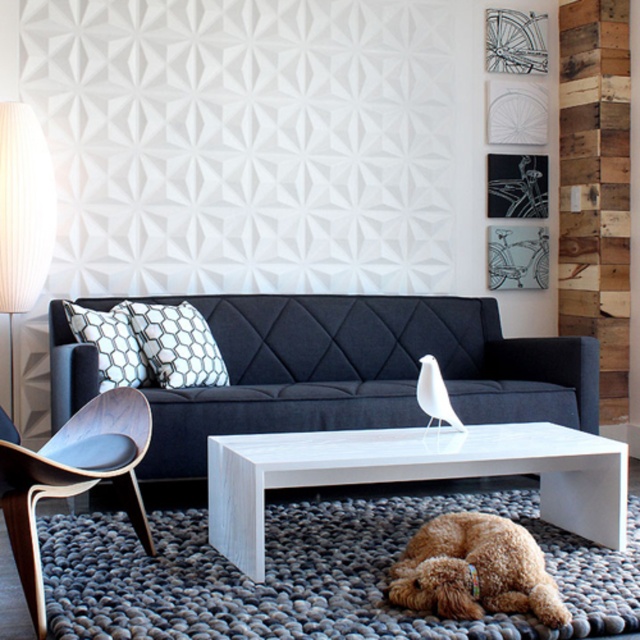
Is dark blue fabric couch at center in front of white pleated fabric lampshade at left?

Yes, dark blue fabric couch at center is in front of white pleated fabric lampshade at left.

Is dark blue fabric couch at center wider than white pleated fabric lampshade at left?

Yes.

Find the location of a particular element. The width and height of the screenshot is (640, 640). dark blue fabric couch at center is located at coordinates (360, 371).

Does dark blue fabric couch at center come behind wooden armchair at left?

Yes, dark blue fabric couch at center is behind wooden armchair at left.

Which is behind, point (168, 432) or point (122, 497)?

The point (168, 432) is behind.

Does point (461, 369) come closer to viewer compared to point (129, 476)?

No, it is behind (129, 476).

The height and width of the screenshot is (640, 640). What are the coordinates of `dark blue fabric couch at center` in the screenshot? It's located at (360, 371).

Which is more to the left, white pleated fabric lampshade at left or white hexagonal pillow at center?

From the viewer's perspective, white pleated fabric lampshade at left appears more on the left side.

Looking at this image, is white pleated fabric lampshade at left closer to camera compared to white hexagonal pillow at center?

No, white pleated fabric lampshade at left is further to the viewer.

Is point (49, 202) positioned before point (180, 360)?

That is False.

The height and width of the screenshot is (640, 640). Find the location of `white pleated fabric lampshade at left`. white pleated fabric lampshade at left is located at coordinates (22, 214).